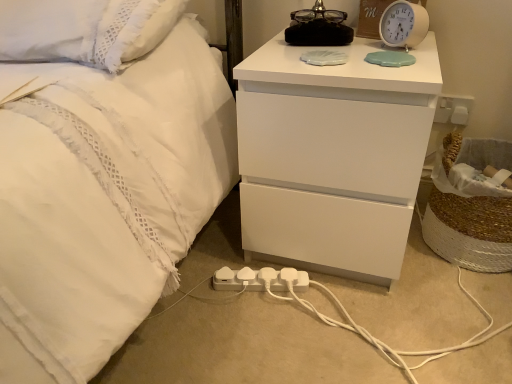
Image resolution: width=512 pixels, height=384 pixels. I want to click on vacant space that is to the left of white plastic extension cord at lower center, so click(193, 300).